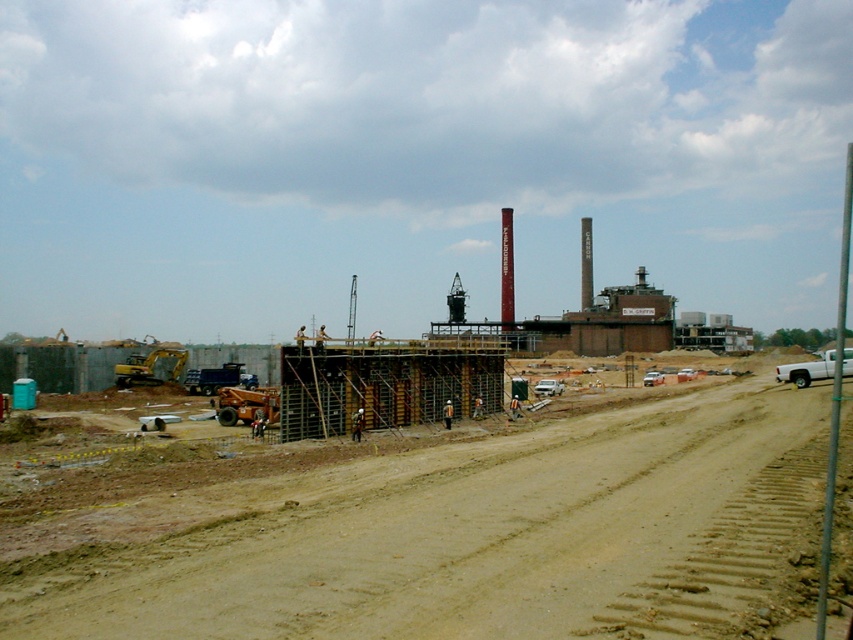
Does brown sandy dirt field at center appear on the right side of yellow rubber excavator at center-left?

Indeed, brown sandy dirt field at center is positioned on the right side of yellow rubber excavator at center-left.

Who is positioned more to the left, brown sandy dirt field at center or yellow rubber excavator at center-left?

yellow rubber excavator at center-left is more to the left.

The image size is (853, 640). What do you see at coordinates (437, 525) in the screenshot?
I see `brown sandy dirt field at center` at bounding box center [437, 525].

Locate an element on the screen. This screenshot has width=853, height=640. brown sandy dirt field at center is located at coordinates (437, 525).